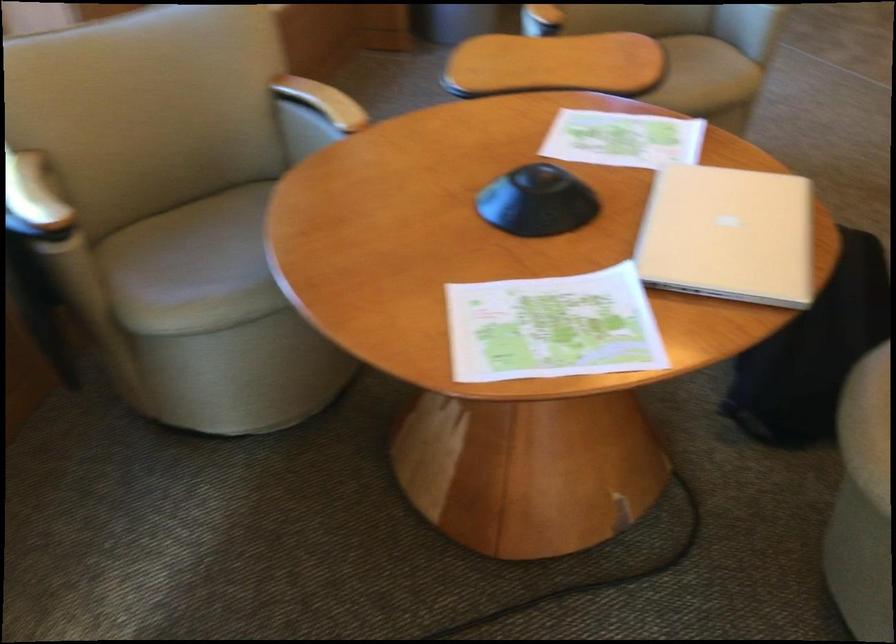
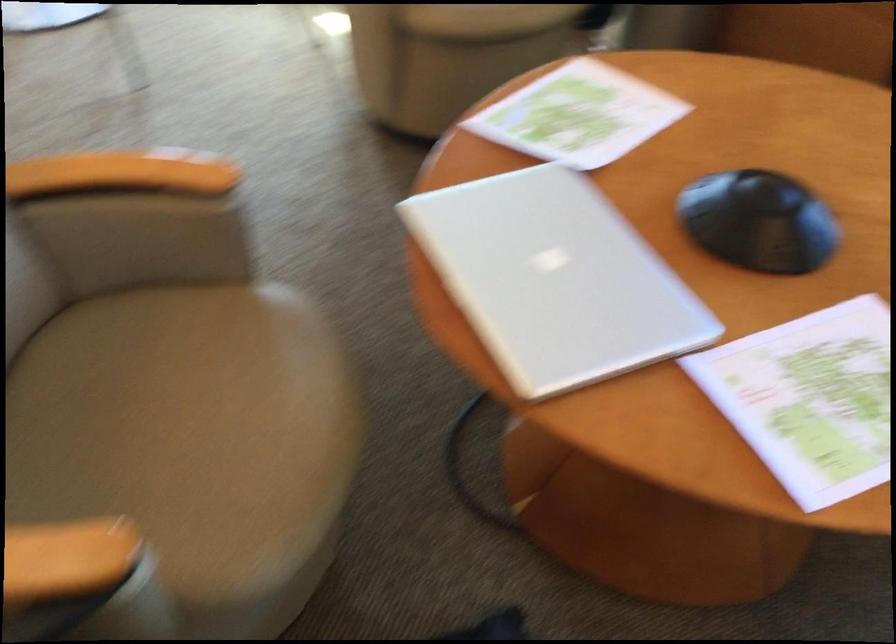
Locate, in the second image, the point that corresponds to [470,363] in the first image.

(579, 115)